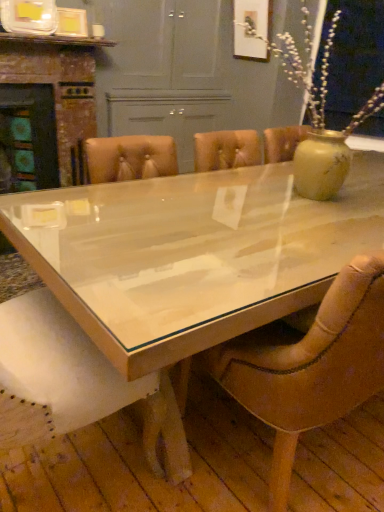
Question: Is leather at center bigger than clear glass table at center?

Choices:
 (A) yes
 (B) no

Answer: (B)

Question: Can you confirm if leather at center is positioned to the right of clear glass table at center?

Choices:
 (A) yes
 (B) no

Answer: (B)

Question: Are leather at center and clear glass table at center located far from each other?

Choices:
 (A) yes
 (B) no

Answer: (B)

Question: From the image's perspective, is leather at center beneath clear glass table at center?

Choices:
 (A) yes
 (B) no

Answer: (A)

Question: Considering the relative positions of leather at center and clear glass table at center in the image provided, is leather at center to the left of clear glass table at center from the viewer's perspective?

Choices:
 (A) yes
 (B) no

Answer: (A)

Question: Is leather at center oriented towards clear glass table at center?

Choices:
 (A) no
 (B) yes

Answer: (B)

Question: Does leather at center have a lesser width compared to wooden fireplace at left?

Choices:
 (A) yes
 (B) no

Answer: (B)

Question: Would you say leather at center is outside wooden fireplace at left?

Choices:
 (A) no
 (B) yes

Answer: (B)

Question: Is wooden fireplace at left located within leather at center?

Choices:
 (A) yes
 (B) no

Answer: (B)

Question: From a real-world perspective, does leather at center sit lower than wooden fireplace at left?

Choices:
 (A) yes
 (B) no

Answer: (A)

Question: Is leather at center wider than wooden fireplace at left?

Choices:
 (A) yes
 (B) no

Answer: (A)

Question: From the image's perspective, is leather at center located above wooden fireplace at left?

Choices:
 (A) no
 (B) yes

Answer: (A)

Question: Is wooden fireplace at left oriented towards leather at center?

Choices:
 (A) yes
 (B) no

Answer: (A)